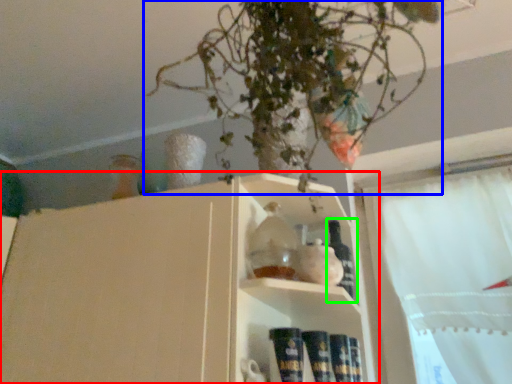
Question: Based on their relative distances, which object is nearer to shelf (highlighted by a red box)? Choose from houseplant (highlighted by a blue box) and bottle (highlighted by a green box).

Choices:
 (A) houseplant
 (B) bottle

Answer: (A)